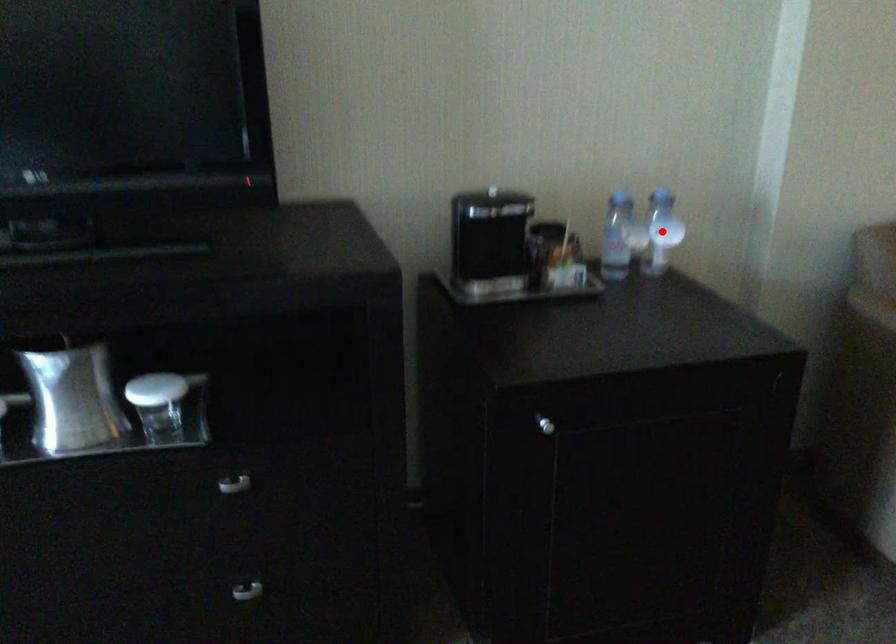
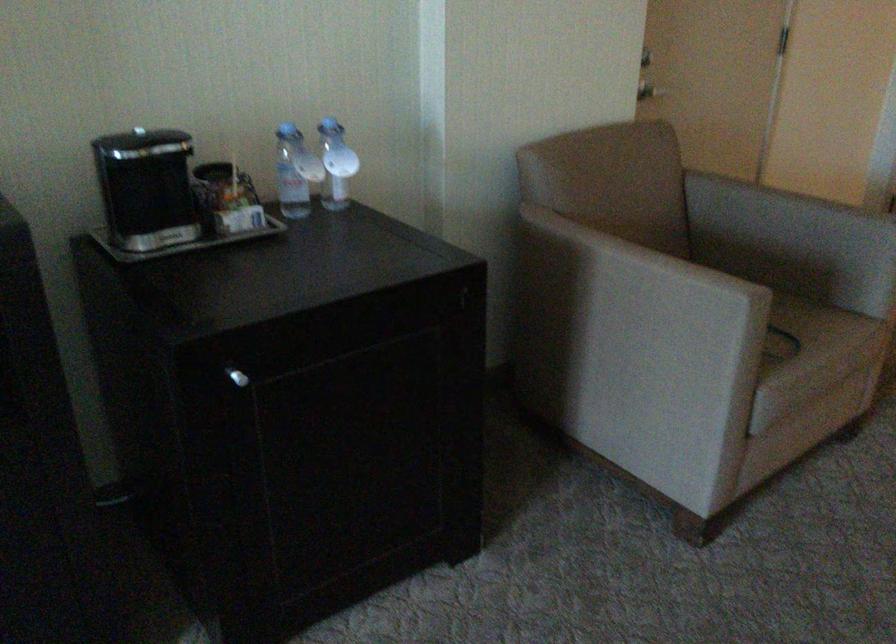
Locate, in the second image, the point that corresponds to the highlighted location in the first image.

(336, 164)